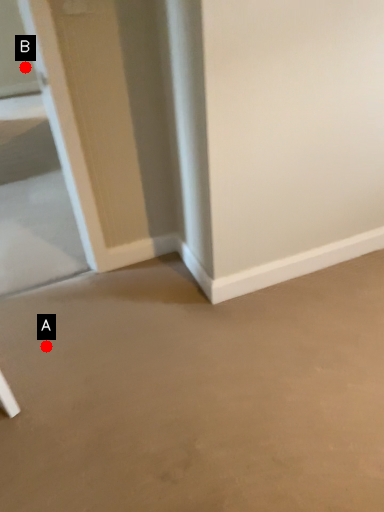
Question: Two points are circled on the image, labeled by A and B beside each circle. Which of the following is the farthest from the observer?

Choices:
 (A) A is further
 (B) B is further

Answer: (B)